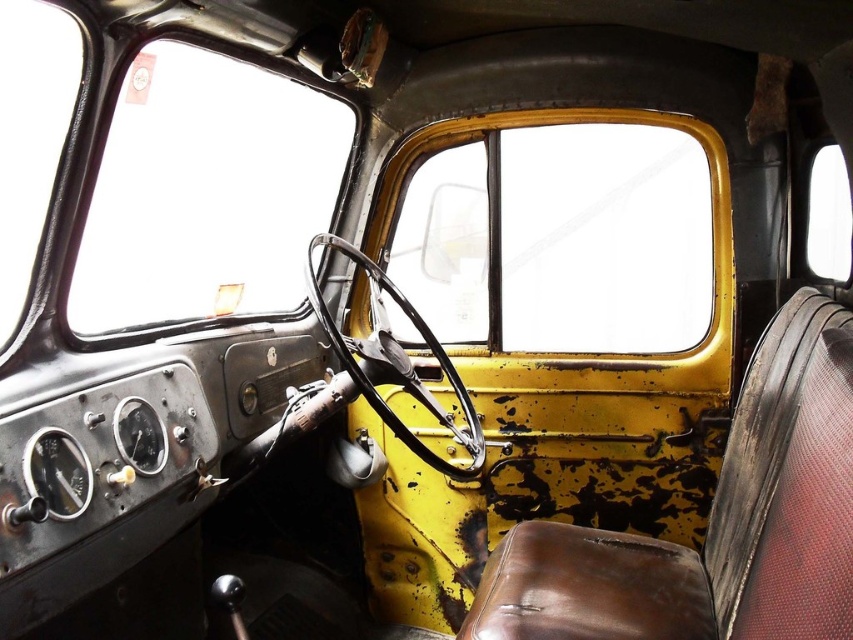
Is clear glass window at upper left positioned in front of transparent glass window at upper right?

Yes, it is.

Between clear glass window at upper left and transparent glass window at upper right, which one appears on the right side from the viewer's perspective?

transparent glass window at upper right is more to the right.

Measure the distance between point (100,332) and camera.

Point (100,332) and camera are 5.50 feet apart from each other.

Locate an element on the screen. The width and height of the screenshot is (853, 640). clear glass window at upper left is located at coordinates (206, 193).

Which is more to the right, yellow metallic window at center or clear glass window at upper left?

From the viewer's perspective, yellow metallic window at center appears more on the right side.

Can you confirm if yellow metallic window at center is positioned below clear glass window at upper left?

Indeed, yellow metallic window at center is positioned under clear glass window at upper left.

The width and height of the screenshot is (853, 640). I want to click on yellow metallic window at center, so click(x=560, y=240).

Is yellow metallic window at center positioned before transparent glass window at upper right?

No.

Does yellow metallic window at center appear on the left side of transparent glass window at upper right?

Yes, yellow metallic window at center is to the left of transparent glass window at upper right.

Which is behind, point (474, 192) or point (820, 198)?

Positioned behind is point (474, 192).

The width and height of the screenshot is (853, 640). Identify the location of yellow metallic window at center. (560, 240).